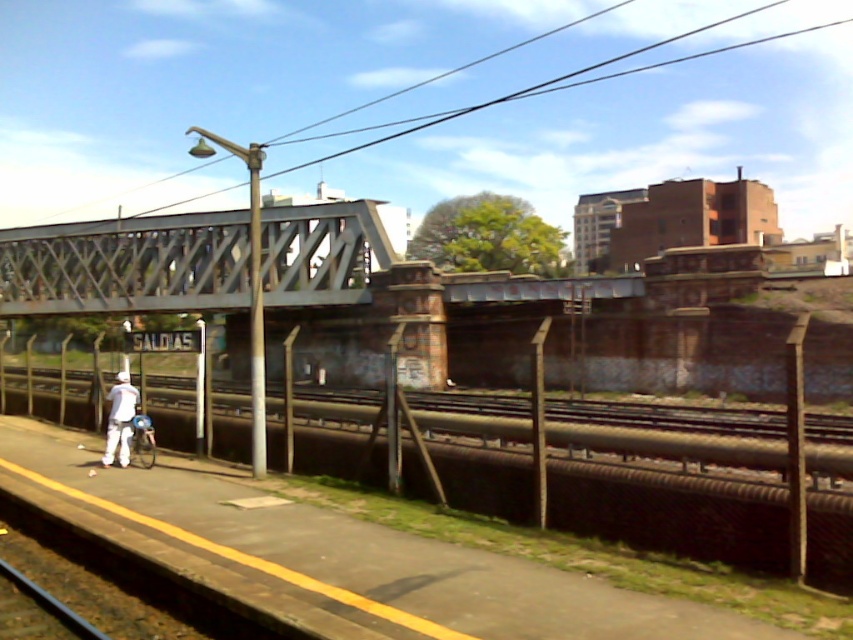
Question: Is metallic gray bridge at upper center wider than white matte pants at lower left?

Choices:
 (A) no
 (B) yes

Answer: (B)

Question: Does metallic gray bridge at upper center appear on the right side of white matte pants at lower left?

Choices:
 (A) no
 (B) yes

Answer: (A)

Question: Can you confirm if smooth metal rail at center is positioned below metallic gray bridge at upper center?

Choices:
 (A) no
 (B) yes

Answer: (B)

Question: Among these points, which one is nearest to the camera?

Choices:
 (A) (737, 536)
 (B) (109, 454)
 (C) (120, 304)

Answer: (A)

Question: Which object is closer to the camera taking this photo?

Choices:
 (A) white matte pants at lower left
 (B) metallic gray bridge at upper center

Answer: (A)

Question: Which object is farther from the camera taking this photo?

Choices:
 (A) smooth metal rail at center
 (B) white matte pants at lower left
 (C) metallic gray bridge at upper center

Answer: (C)